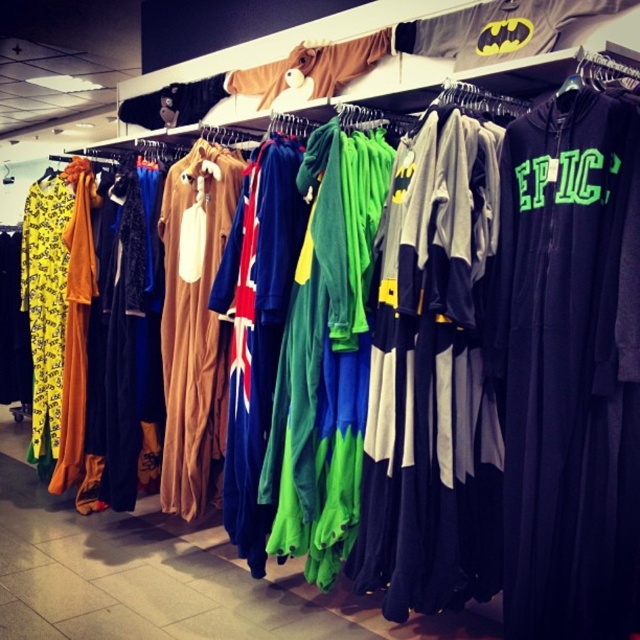
Question: Can you confirm if gray cotton t-shirt at upper center is thinner than brown plush onesie at upper center?

Choices:
 (A) yes
 (B) no

Answer: (A)

Question: Does gray cotton t-shirt at upper center come in front of brown plush onesie at upper center?

Choices:
 (A) yes
 (B) no

Answer: (A)

Question: Which point is closer to the camera?

Choices:
 (A) gray cotton t-shirt at upper center
 (B) brown plush onesie at upper center

Answer: (A)

Question: Is gray cotton t-shirt at upper center bigger than brown plush onesie at upper center?

Choices:
 (A) yes
 (B) no

Answer: (B)

Question: Among these points, which one is farthest from the camera?

Choices:
 (A) tap(358, 74)
 (B) tap(548, 28)

Answer: (A)